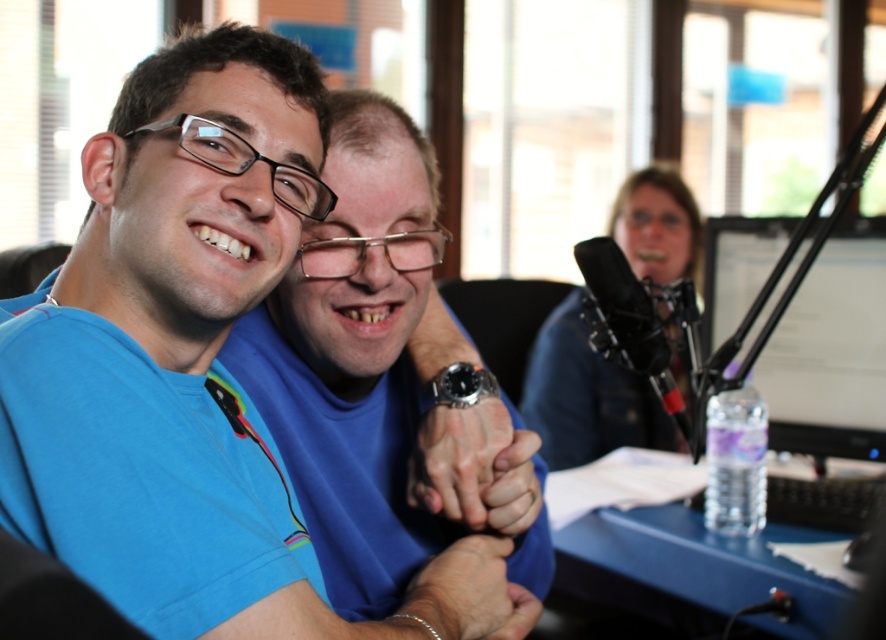
Question: Can you confirm if blue matte shirt at center is positioned to the right of matte black monitor at right?

Choices:
 (A) no
 (B) yes

Answer: (A)

Question: Which point is closer to the camera taking this photo?

Choices:
 (A) (x=405, y=602)
 (B) (x=571, y=506)
 (C) (x=271, y=164)
 (D) (x=703, y=317)

Answer: (C)

Question: Considering the real-world distances, which object is farthest from the smooth skin hand at center?

Choices:
 (A) blue fabric shirt at center
 (B) blue matte shirt at center

Answer: (A)

Question: Is the position of blue plastic table at lower right more distant than that of blue fabric shirt at center?

Choices:
 (A) yes
 (B) no

Answer: (B)

Question: Estimate the real-world distances between objects in this image. Which object is farther from the smooth skin hand at center?

Choices:
 (A) blue matte shirt at center
 (B) matte black monitor at right
 (C) blue fabric shirt at center

Answer: (C)

Question: Is blue plastic table at lower right to the left of smooth skin hand at center from the viewer's perspective?

Choices:
 (A) no
 (B) yes

Answer: (A)